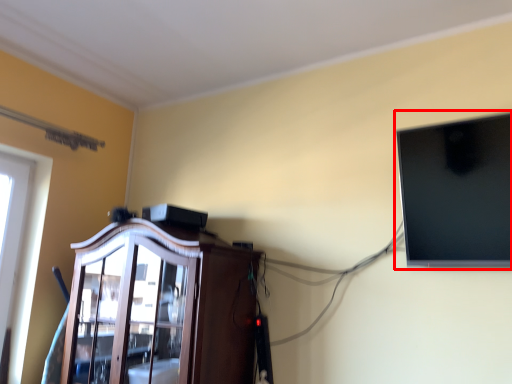
Question: From the image's perspective, what is the correct spatial relationship of computer monitor (annotated by the red box) in relation to cabinetry?

Choices:
 (A) above
 (B) below

Answer: (A)